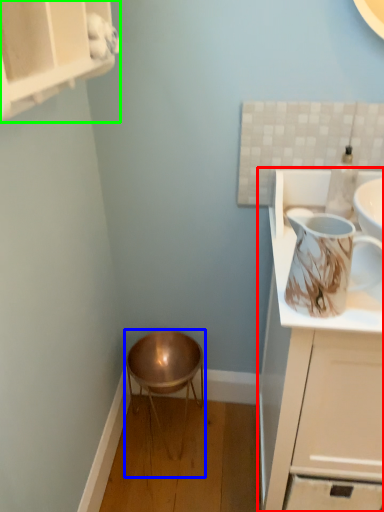
Question: Which is farther away from cabinetry (highlighted by a red box)? stool (highlighted by a blue box) or cabinetry (highlighted by a green box)?

Choices:
 (A) stool
 (B) cabinetry

Answer: (B)